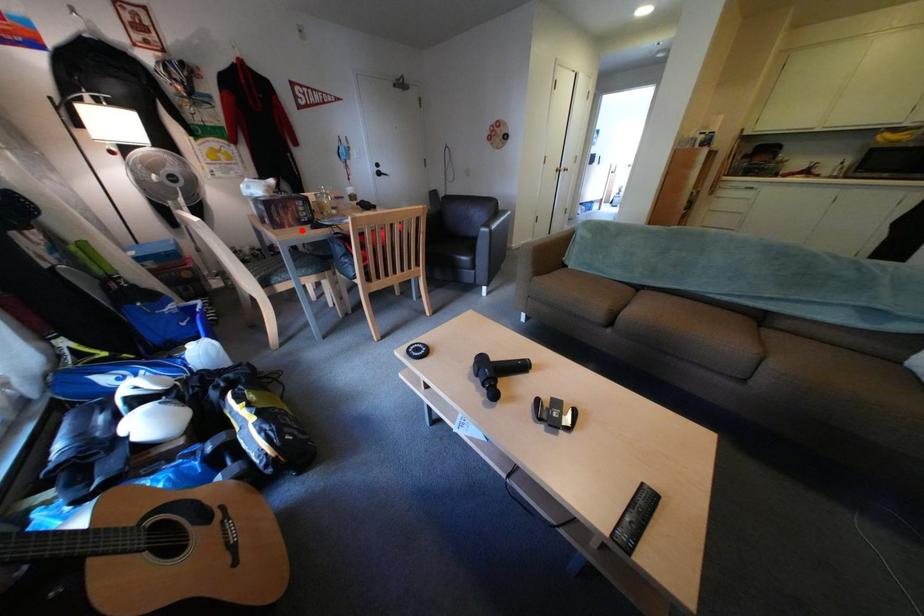
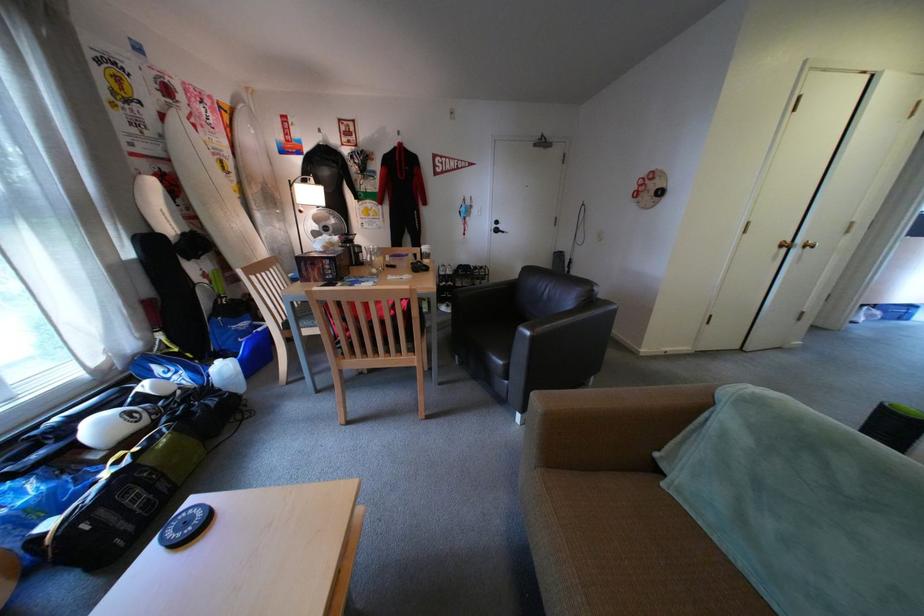
Where in the second image is the point corresponding to the highlighted location from the first image?

(325, 285)